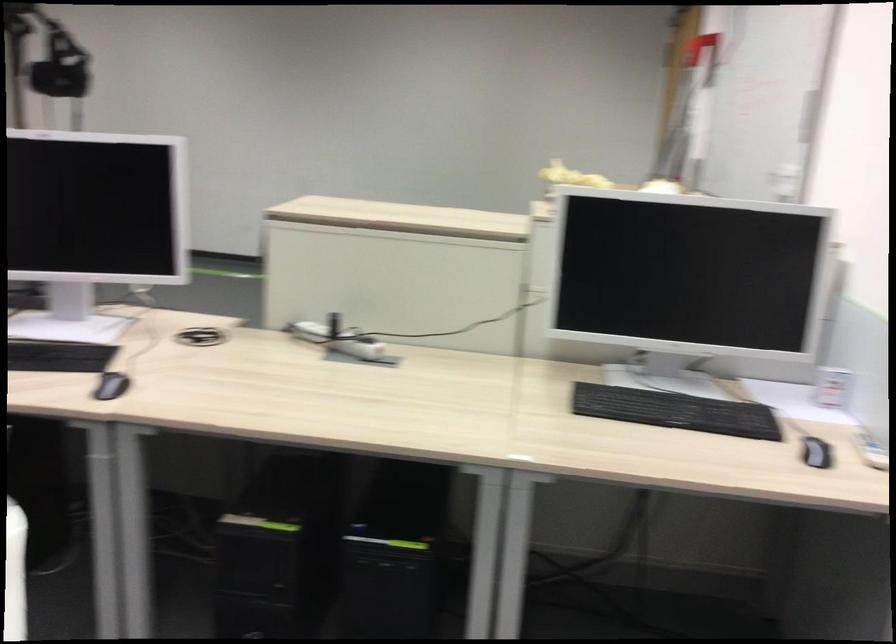
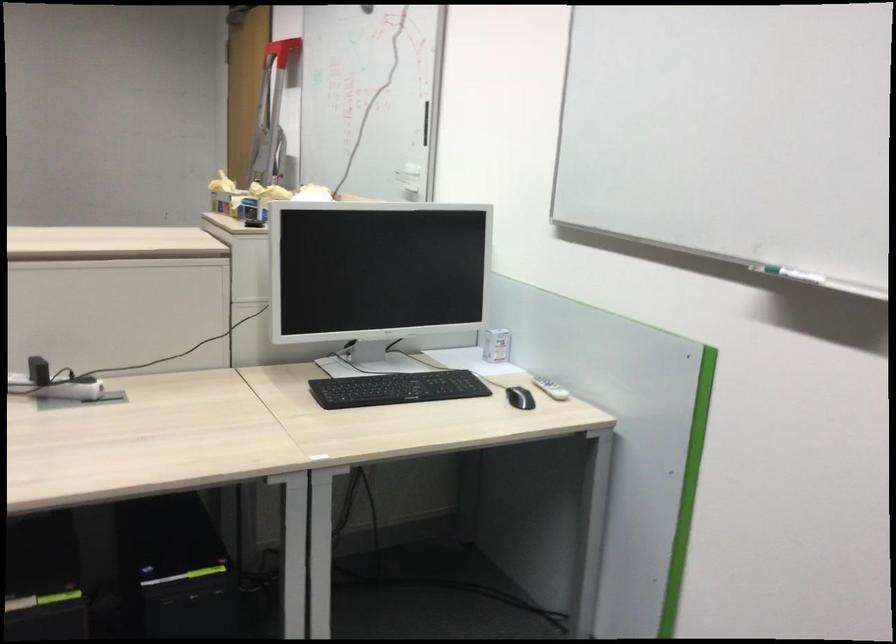
In the second image, find the point that corresponds to point (814, 105) in the first image.

(426, 122)